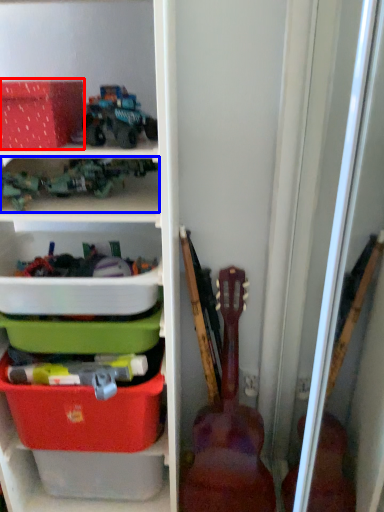
Question: Which of the following is the closest to the observer, storage box (highlighted by a red box) or toy (highlighted by a blue box)?

Choices:
 (A) storage box
 (B) toy

Answer: (A)